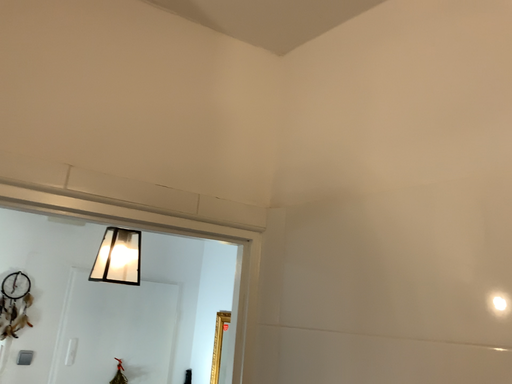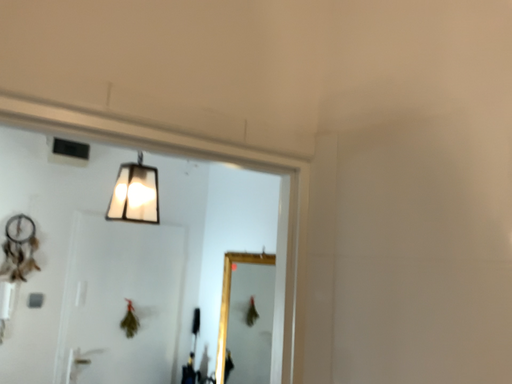
Question: How did the camera likely rotate when shooting the video?

Choices:
 (A) rotated downward
 (B) rotated upward

Answer: (A)